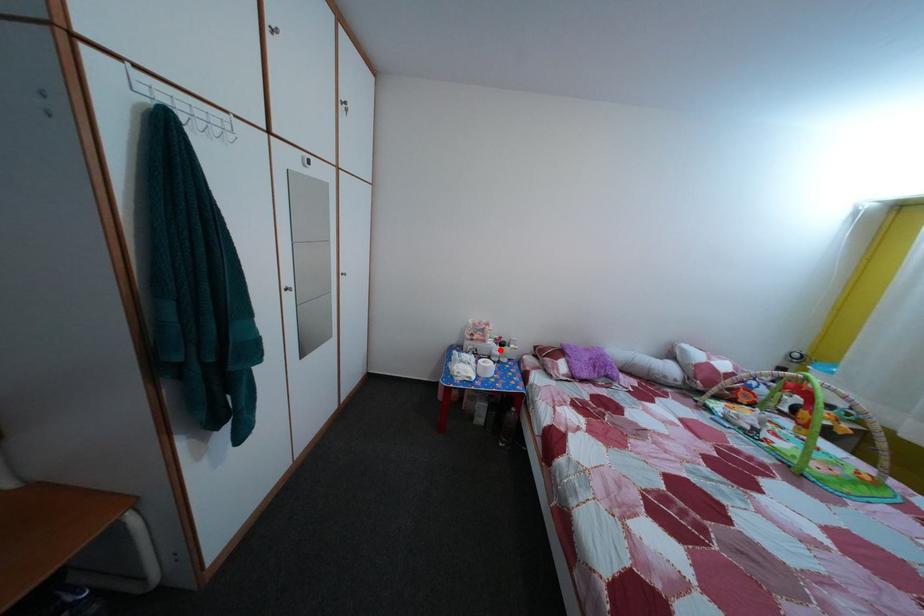
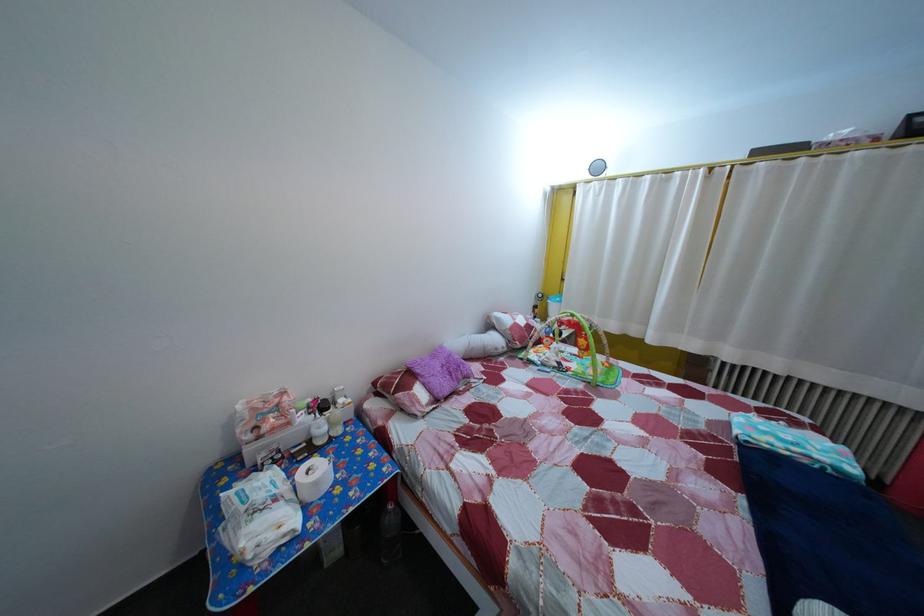
Locate, in the second image, the point that corresponds to the highlighted location in the first image.

(311, 427)